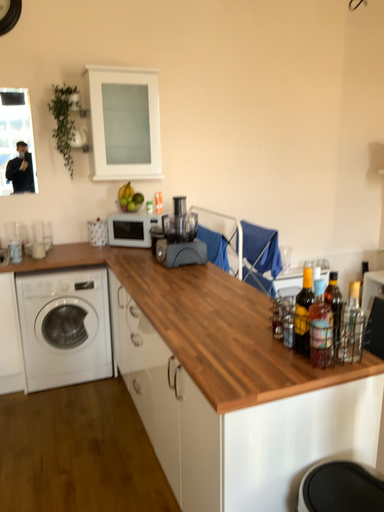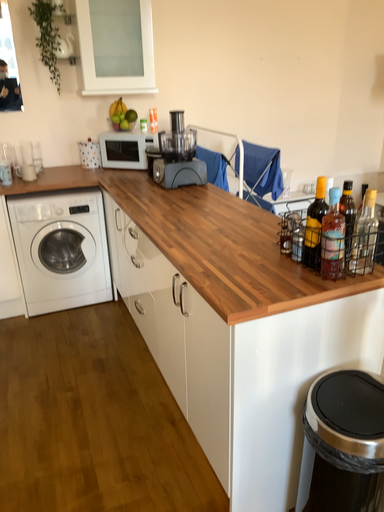
Question: How did the camera likely rotate when shooting the video?

Choices:
 (A) rotated downward
 (B) rotated upward

Answer: (A)